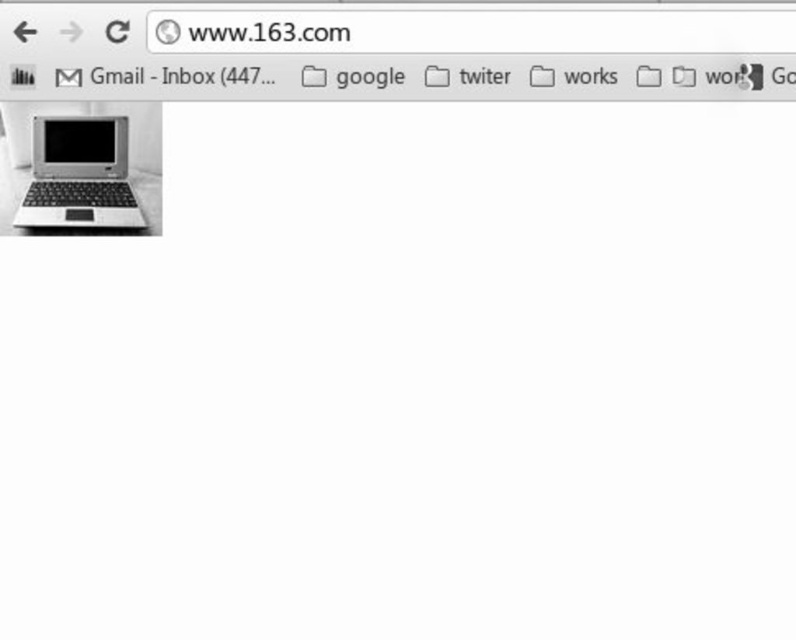
Between matte black laptop at left and matte black screen at center, which one has more height?

With more height is matte black laptop at left.

Which is more to the right, matte black laptop at left or matte black screen at center?

matte black laptop at left is more to the right.

You are a GUI agent. You are given a task and a screenshot of the screen. Output one action in this format:
    pyautogui.click(x=<x>, y=<y>)
    Task: Click on the matte black laptop at left
    The height and width of the screenshot is (640, 796).
    Given the screenshot: What is the action you would take?
    pyautogui.click(x=80, y=176)

Find the location of a particular element. Image resolution: width=796 pixels, height=640 pixels. matte black laptop at left is located at coordinates (80, 176).